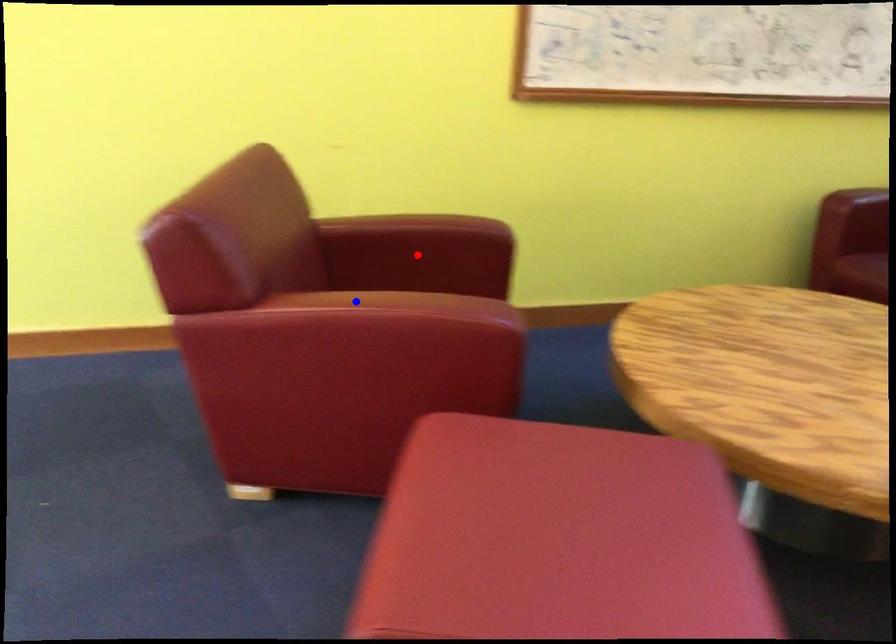
Question: In the image, two points are highlighted. Which point is nearer to the camera? Reply with the corresponding letter.

Choices:
 (A) blue point
 (B) red point

Answer: (A)